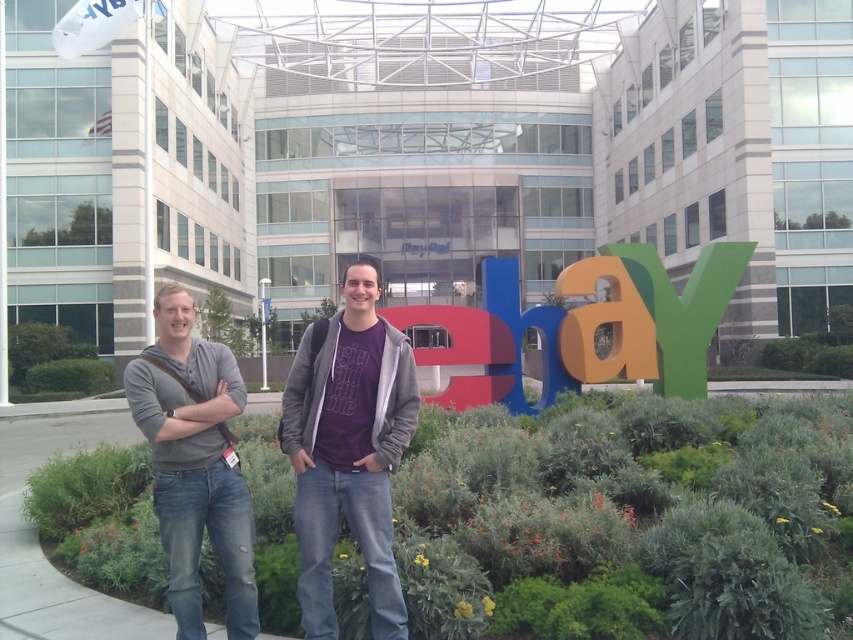
Question: Is gray cotton hoodie at left to the right of orange matte letter at center from the viewer's perspective?

Choices:
 (A) yes
 (B) no

Answer: (B)

Question: Is gray cotton hoodie at center wider than orange matte letter at center?

Choices:
 (A) no
 (B) yes

Answer: (B)

Question: Based on their relative distances, which object is farther from the orange matte letter at center?

Choices:
 (A) gray cotton hoodie at center
 (B) gray cotton hoodie at left

Answer: (B)

Question: Which point is closer to the camera?

Choices:
 (A) (x=566, y=332)
 (B) (x=344, y=282)

Answer: (B)

Question: Estimate the real-world distances between objects in this image. Which object is closer to the gray cotton hoodie at center?

Choices:
 (A) orange matte letter at center
 (B) purple matte shirt at center

Answer: (B)

Question: From the image, what is the correct spatial relationship of gray cotton hoodie at center in relation to orange matte letter at center?

Choices:
 (A) left
 (B) right

Answer: (A)